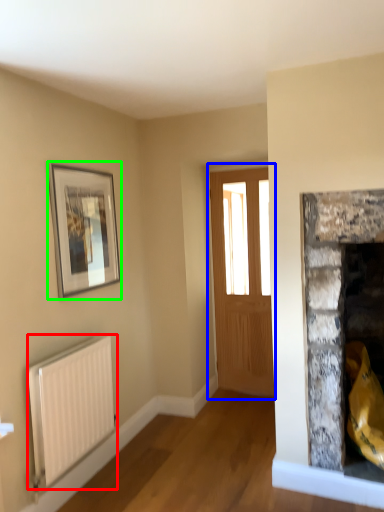
Question: Which object is positioned farthest from radiator (highlighted by a red box)? Select from window (highlighted by a blue box) and picture frame (highlighted by a green box).

Choices:
 (A) window
 (B) picture frame

Answer: (A)